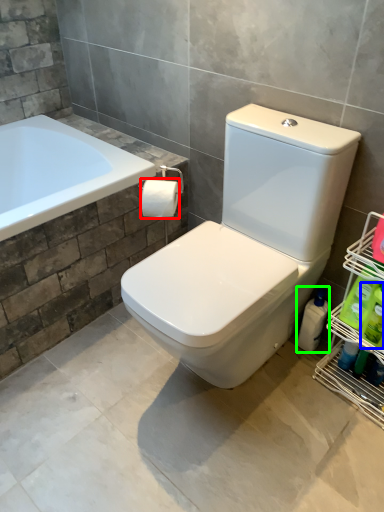
Question: Considering the real-world distances, which object is farthest from toilet paper (highlighted by a red box)? cleaning product (highlighted by a blue box) or cleaning product (highlighted by a green box)?

Choices:
 (A) cleaning product
 (B) cleaning product

Answer: (A)